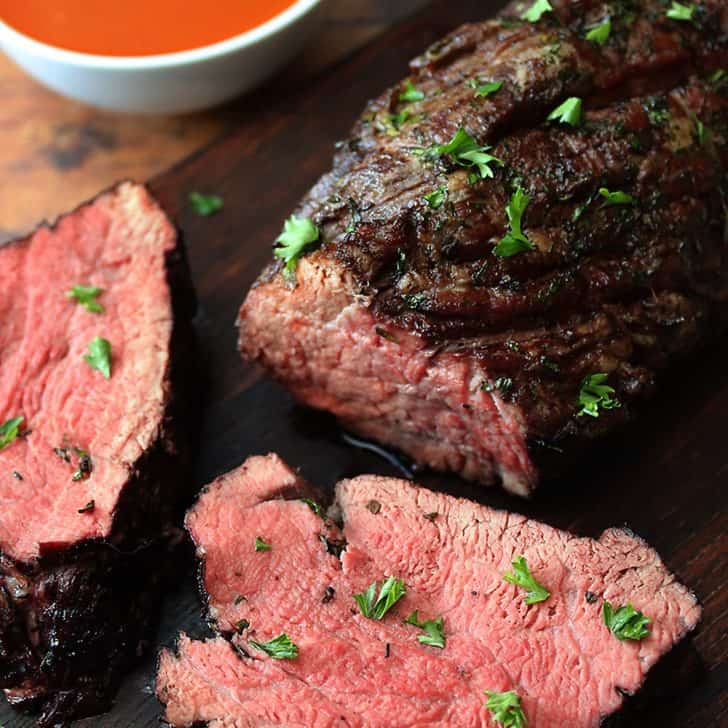
In order to click on bowl in this screenshot , I will do `click(157, 92)`.